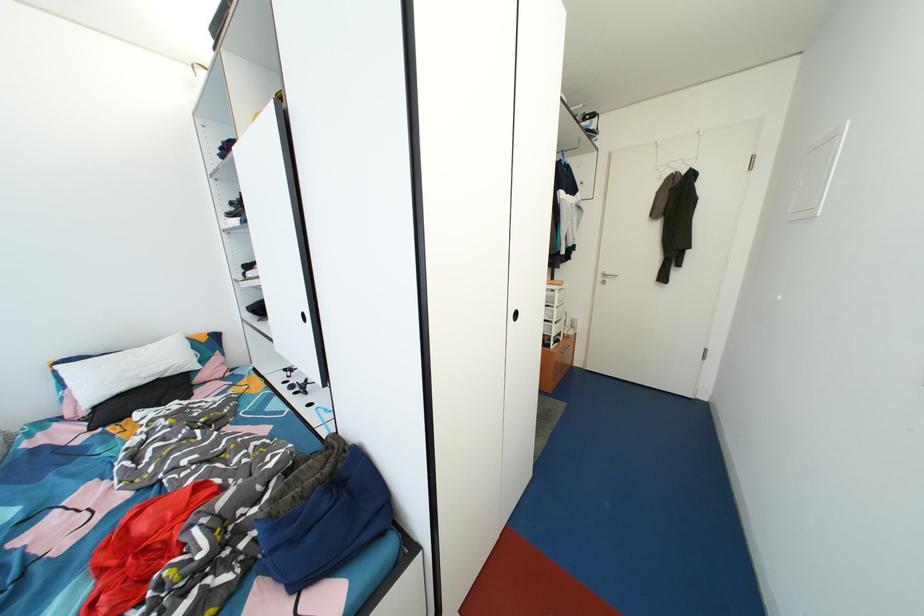
The location [298,387] corresponds to which object?

It refers to a black clip.